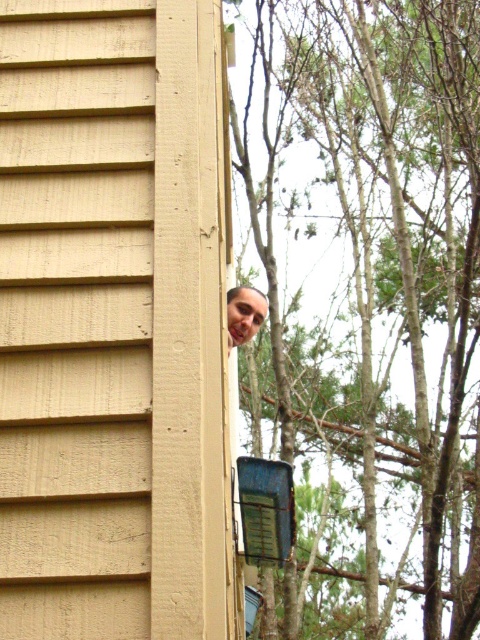
Question: Which point is farther from the camera taking this photo?

Choices:
 (A) (303, 4)
 (B) (245, 296)

Answer: (A)

Question: In this image, where is green leafy tree at upper right located relative to matte brown hair at upper right?

Choices:
 (A) right
 (B) left

Answer: (A)

Question: Which of the following is the farthest from the observer?

Choices:
 (A) (229, 336)
 (B) (463, 156)

Answer: (B)

Question: In this image, where is green leafy tree at upper right located relative to matte brown hair at upper right?

Choices:
 (A) right
 (B) left

Answer: (A)

Question: Can you confirm if green leafy tree at upper right is wider than matte brown hair at upper right?

Choices:
 (A) yes
 (B) no

Answer: (A)